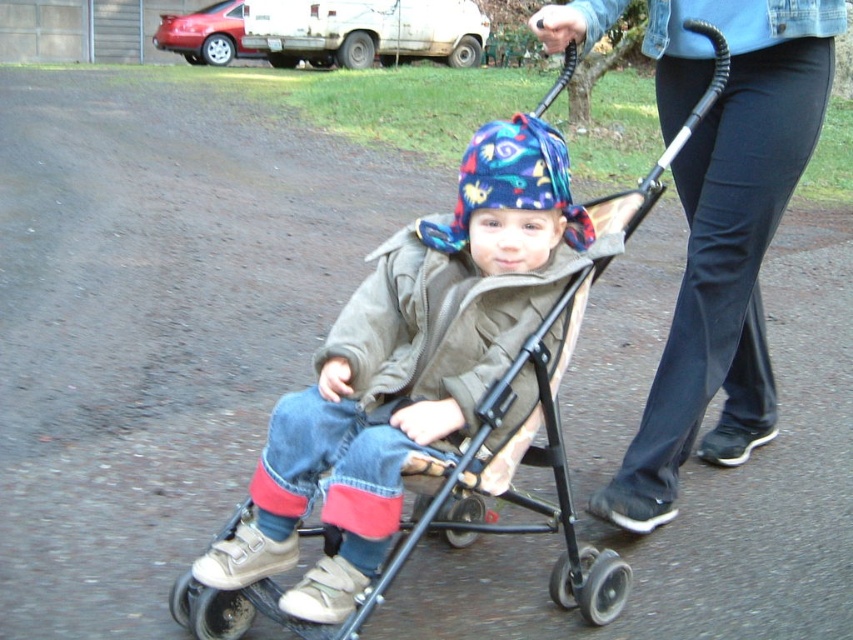
You are a delivery person trying to deliver a package to the adult pushing the stroller. The package is for the adult, but you need to confirm their clothing details. Which clothing item is closer to you between the denim pants at center and the multicolored fabric hat at center?

The denim pants at center is closer to you because the multicolored fabric hat at center is behind it.

You are a delivery robot trying to navigate through the path. You see the denim pants at center and the metallic stroller at center. Which object is directly above the other?

The denim pants at center is positioned over metallic stroller at center, so the denim pants at center is directly above the metallic stroller at center.

You are a delivery robot that needs to pass under a low hanging tree branch that is 1.2 meters tall. You are currently facing the metallic stroller at center and the multicolored fabric hat at center. Which object do you need to avoid hitting your head on when passing under the branch?

The metallic stroller at center is taller than the multicolored fabric hat at center. Since the branch is 1.2 meters tall, you should avoid the metallic stroller at center as it is taller and may hit the branch.